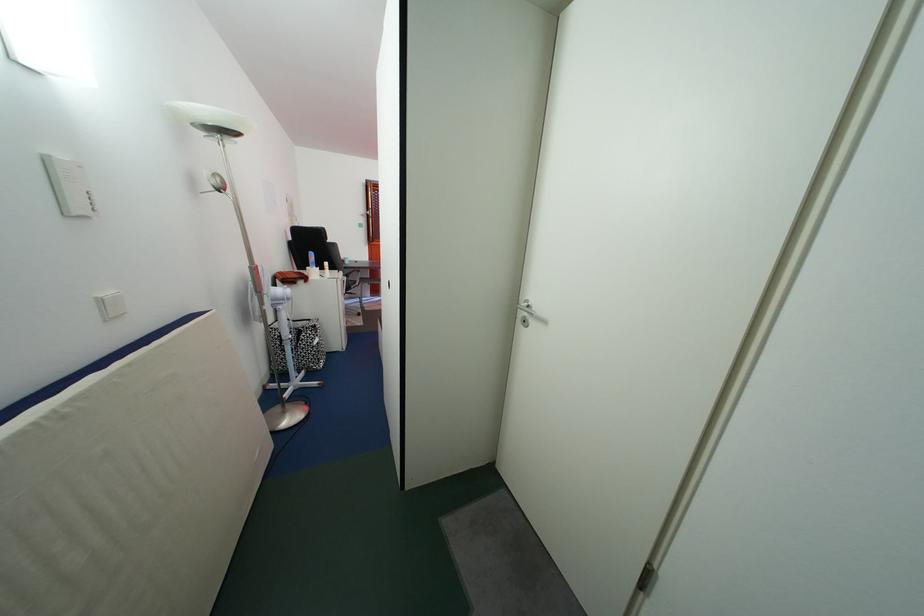
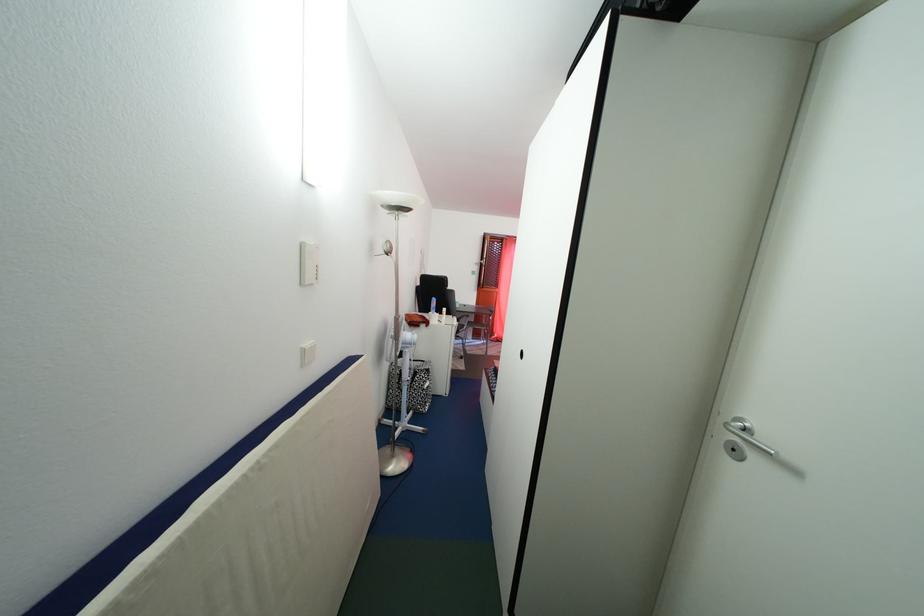
The point at (536, 308) is marked in the first image. Where is the corresponding point in the second image?

(748, 426)